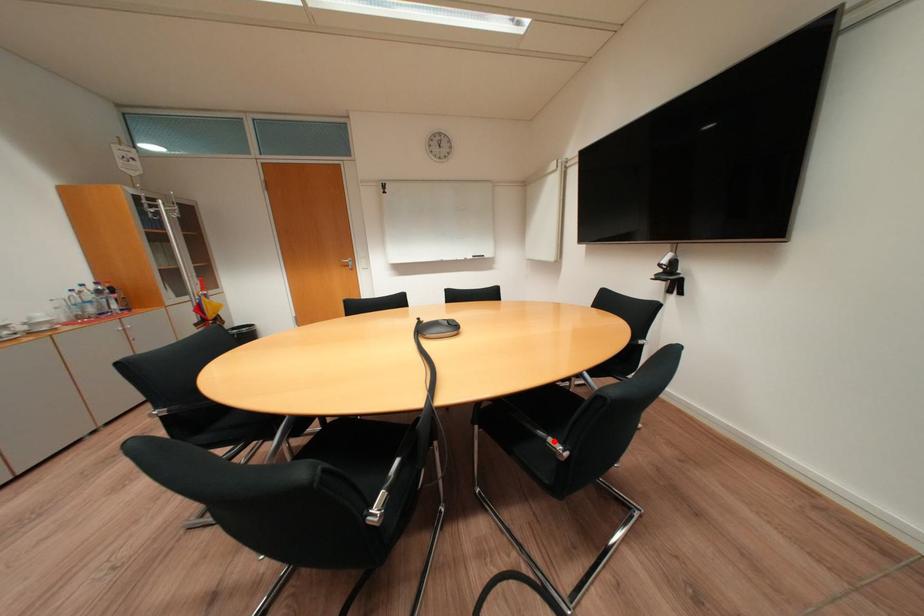
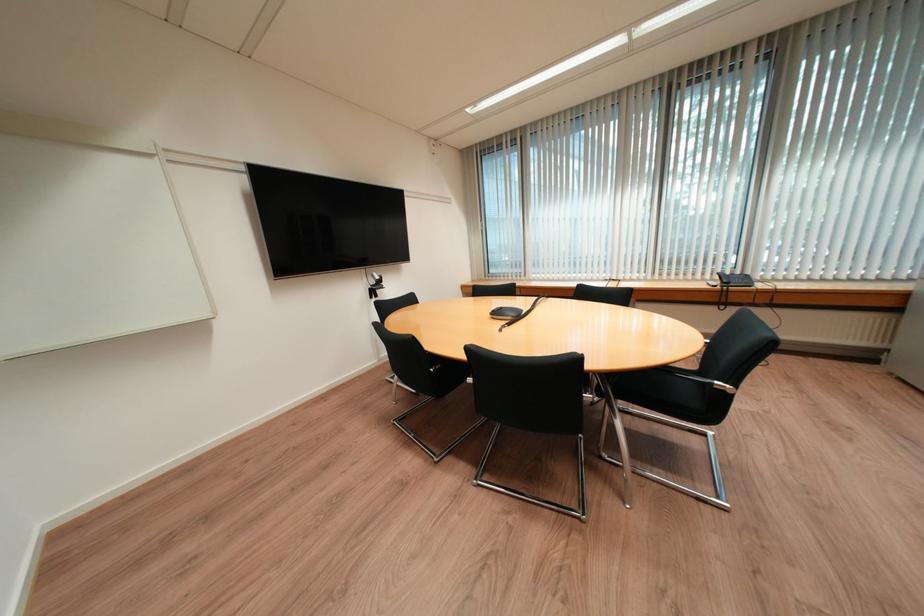
Question: I am providing you with two images of the same scene from different viewpoints. A red point is marked on the first image. Can you still see the location of the red point in image 2?

Choices:
 (A) Yes
 (B) No

Answer: (B)